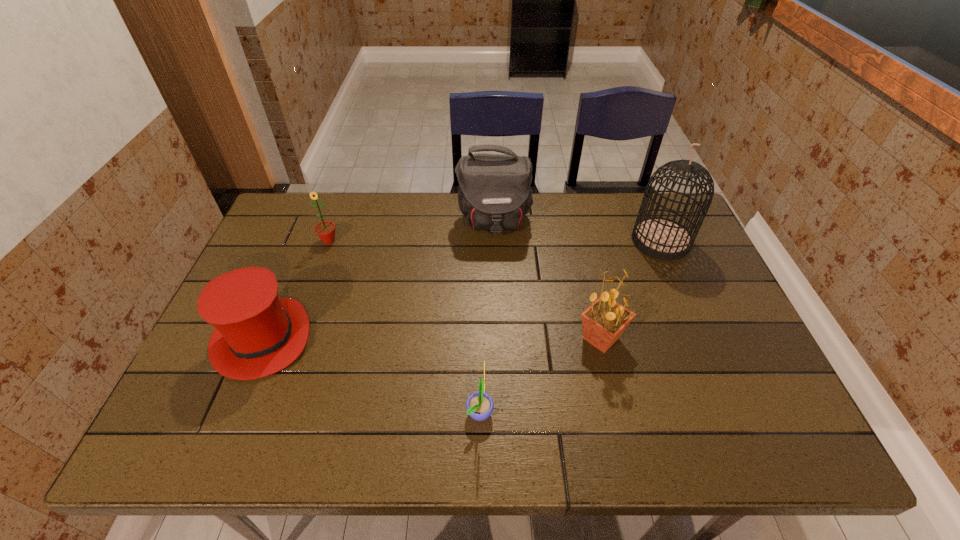
This screenshot has height=540, width=960. What are the coordinates of `object that is at the near edge` in the screenshot? It's located at (479, 405).

Find the location of a particular element. This screenshot has height=540, width=960. object present at the left edge is located at coordinates (256, 334).

Find the location of a particular element. Image resolution: width=960 pixels, height=540 pixels. object located in the right edge section of the desktop is located at coordinates (x=661, y=238).

At what (x,y) coordinates should I click in order to perform the action: click on object that is positioned at the far right corner. Please return your answer as a coordinate pair (x, y). Image resolution: width=960 pixels, height=540 pixels. Looking at the image, I should click on (661, 238).

In the image, there is a desktop. Where is `vacant region at the far edge`? vacant region at the far edge is located at coordinates (558, 219).

The width and height of the screenshot is (960, 540). I want to click on free space at the near edge, so click(x=461, y=449).

This screenshot has width=960, height=540. What are the coordinates of `vacant region at the right edge of the desktop` in the screenshot? It's located at (692, 286).

I want to click on vacant space at the far left corner of the desktop, so (x=284, y=213).

Where is `free region at the near left corner of the desktop`? free region at the near left corner of the desktop is located at coordinates (223, 429).

Find the location of a particular element. This screenshot has width=960, height=540. vacant space at the far right corner is located at coordinates [x=669, y=218].